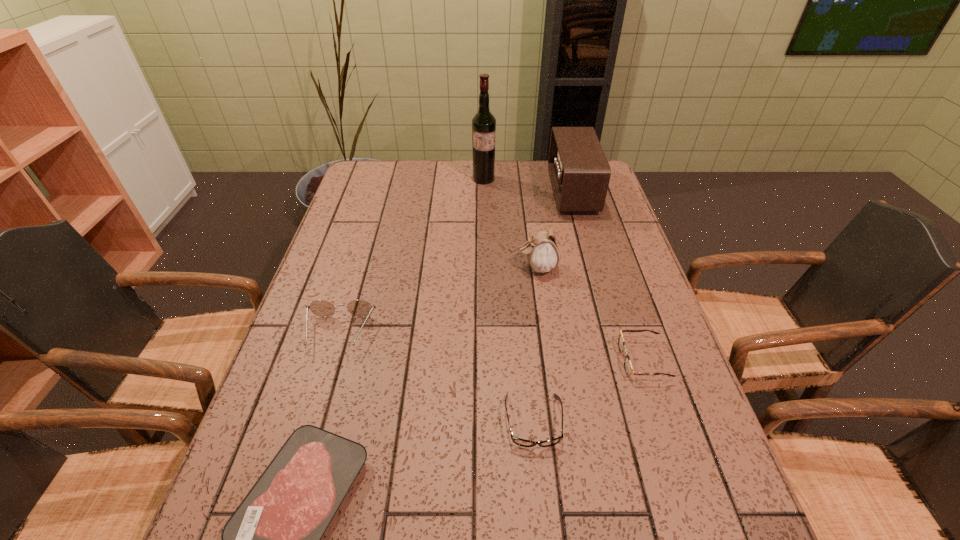
Where is `free space between the tallest object and the fifth nearest object`? free space between the tallest object and the fifth nearest object is located at coordinates (510, 223).

The image size is (960, 540). I want to click on free space between the fourth tallest object and the tallest object, so click(411, 256).

What are the coordinates of `free spot between the rightmost spectacles and the fourth shortest object` in the screenshot? It's located at pyautogui.click(x=491, y=347).

The height and width of the screenshot is (540, 960). Identify the location of vacant point located between the rightmost spectacles and the fifth shortest object. tap(589, 314).

Where is `vacant region between the wine bottle and the fifth shortest object`? The width and height of the screenshot is (960, 540). vacant region between the wine bottle and the fifth shortest object is located at coordinates (510, 223).

At what (x,y) coordinates should I click in order to perform the action: click on free point between the sixth shortest object and the tallest object. Please return your answer as a coordinate pair (x, y). Image resolution: width=960 pixels, height=540 pixels. Looking at the image, I should click on (528, 185).

Where is `vacant space that is in between the rightmost spectacles and the third tallest object`? The height and width of the screenshot is (540, 960). vacant space that is in between the rightmost spectacles and the third tallest object is located at coordinates (589, 314).

Find the location of a particular element. The height and width of the screenshot is (540, 960). vacant area between the rightmost spectacles and the fourth shortest object is located at coordinates (491, 347).

Image resolution: width=960 pixels, height=540 pixels. I want to click on blank region between the rightmost spectacles and the radio receiver, so click(608, 275).

Where is `free spot between the second tallest object and the fifth shortest object`? Image resolution: width=960 pixels, height=540 pixels. free spot between the second tallest object and the fifth shortest object is located at coordinates (555, 230).